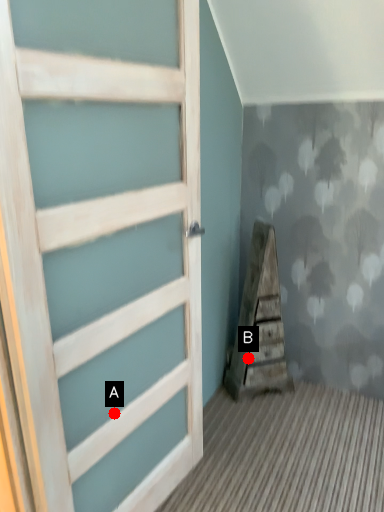
Question: Two points are circled on the image, labeled by A and B beside each circle. Which point appears closest to the camera in this image?

Choices:
 (A) A is closer
 (B) B is closer

Answer: (A)